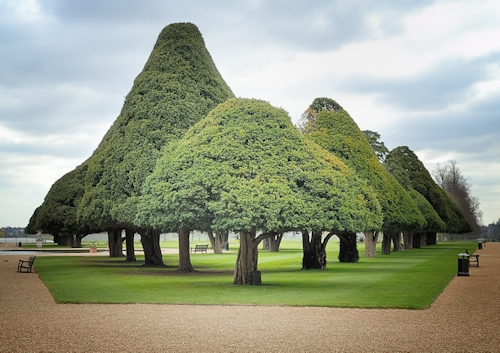
This screenshot has width=500, height=353. I want to click on chair, so click(21, 267).